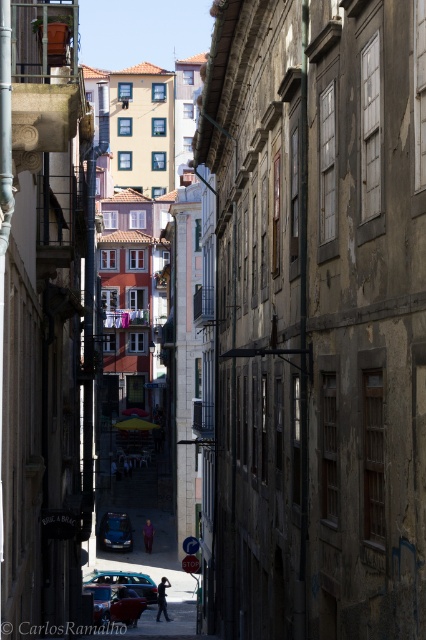
You are a delivery person needing to park your 1.8 meters tall delivery van. You see a metallic car at center and a shiny red car at lower center in the alleyway. Can your van fit between them vertically?

The metallic car at center is taller than the shiny red car at lower center, but the height of the metallic car at center is not provided. Without knowing the exact height of the tallest object, it is impossible to determine if the van can fit vertically between them.

You are standing at the entrance of the alleyway and want to take a photo of the shiny red car at lower center. Where should you position yourself to capture it in the frame?

To capture the shiny red car at lower center in your photo, position yourself at the entrance of the alleyway and aim your camera towards the lower center area where the car is located, as it is situated at coordinates point (x=115, y=604).